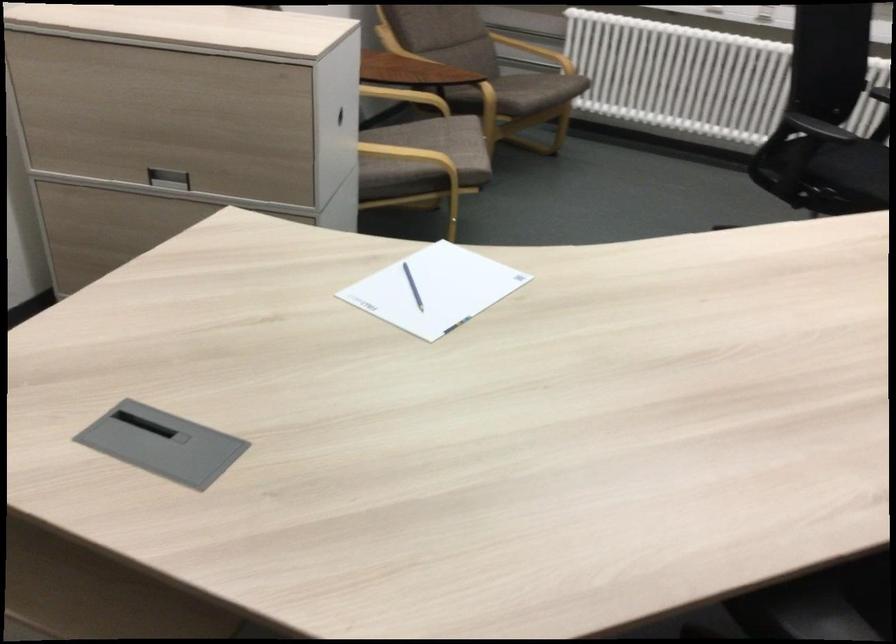
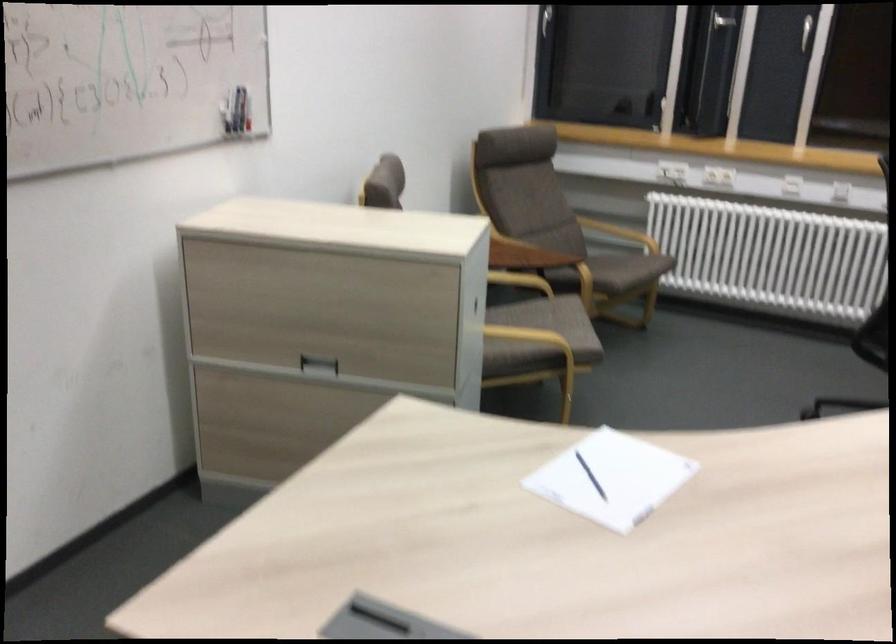
Find the pixel in the second image that matches (x=409, y=158) in the first image.

(528, 336)